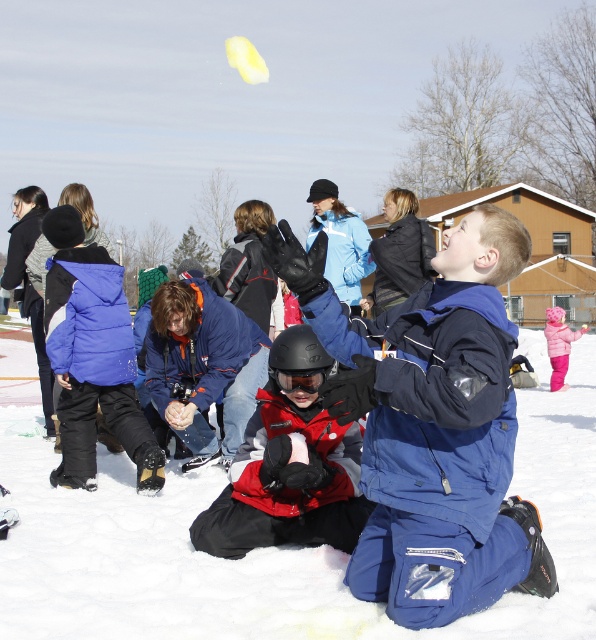
Question: Which point is farther to the camera?

Choices:
 (A) blue softshell jacket at center
 (B) red matte helmet at center
 (C) white fluffy snow at center

Answer: (B)

Question: Is blue softshell jacket at center below pink fleece jacket at lower right?

Choices:
 (A) no
 (B) yes

Answer: (A)

Question: Is white fluffy snow at center below red matte helmet at center?

Choices:
 (A) no
 (B) yes

Answer: (B)

Question: From the image, what is the correct spatial relationship of blue softshell jacket at center in relation to pink fleece jacket at lower right?

Choices:
 (A) right
 (B) left

Answer: (B)

Question: Considering the real-world distances, which object is closest to the white fluffy snow at center?

Choices:
 (A) pink fleece jacket at lower right
 (B) red matte helmet at center
 (C) blue softshell jacket at center

Answer: (B)

Question: Which object is farther from the camera taking this photo?

Choices:
 (A) blue softshell jacket at center
 (B) red matte helmet at center

Answer: (B)